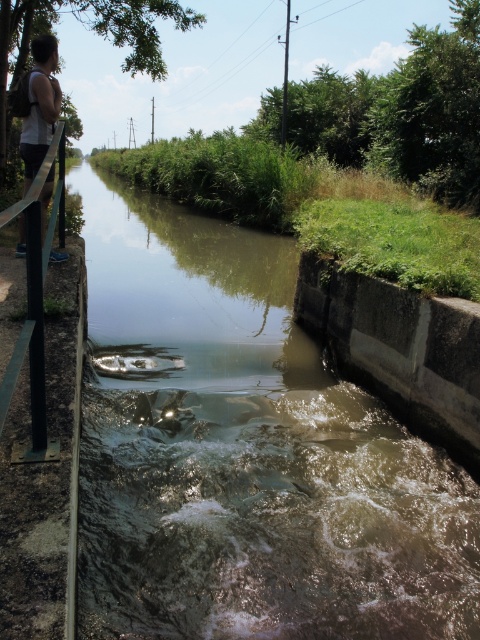
Who is higher up, brown murky water at center or white fabric at left?

brown murky water at center

Does brown murky water at center come behind white fabric at left?

No, it is in front of white fabric at left.

Does point (124, 218) come in front of point (49, 92)?

No, it is behind (49, 92).

You are a GUI agent. You are given a task and a screenshot of the screen. Output one action in this format:
    pyautogui.click(x=<x>, y=<y>)
    Task: Click on the brown murky water at center
    This screenshot has height=640, width=480.
    Given the screenshot: What is the action you would take?
    [244, 452]